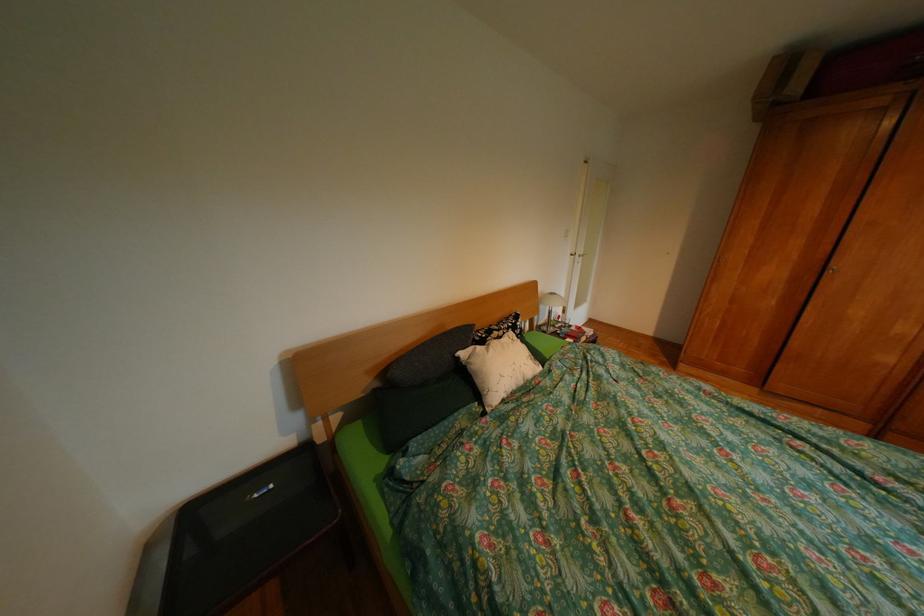
This screenshot has height=616, width=924. I want to click on white door handle, so click(576, 253).